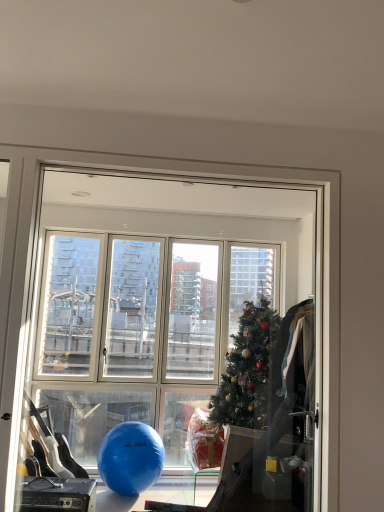
What is the approximate height of clear glass window at center?

clear glass window at center is 5.20 feet in height.

You are a GUI agent. You are given a task and a screenshot of the screen. Output one action in this format:
    pyautogui.click(x=<x>, y=<y>)
    Task: Click on the clear glass window at center
    The width and height of the screenshot is (384, 512).
    Given the screenshot: What is the action you would take?
    pyautogui.click(x=174, y=318)

The height and width of the screenshot is (512, 384). What do you see at coordinates (174, 318) in the screenshot? I see `clear glass window at center` at bounding box center [174, 318].

The image size is (384, 512). Identify the location of clear glass window at center. (174, 318).